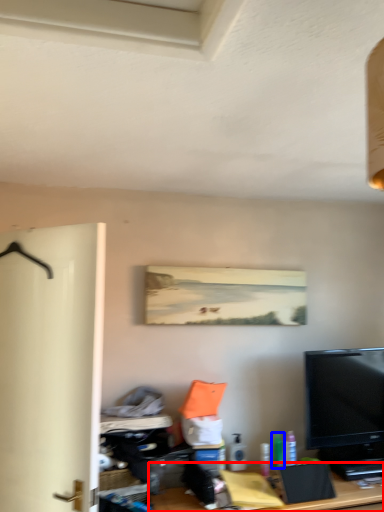
Question: Which object appears closest to the camera in this image, desk (highlighted by a red box) or toiletry (highlighted by a blue box)?

Choices:
 (A) desk
 (B) toiletry

Answer: (A)